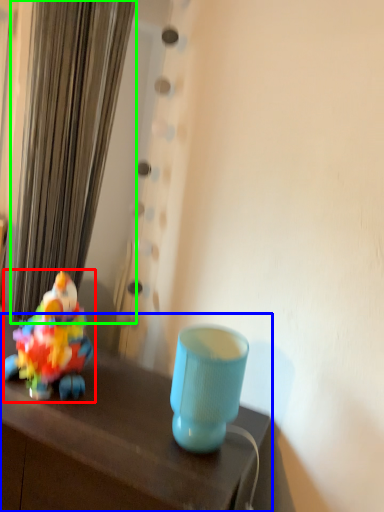
Question: Which object is the closest to the toy (highlighted by a red box)? Choose among these: table (highlighted by a blue box) or curtain (highlighted by a green box).

Choices:
 (A) table
 (B) curtain

Answer: (A)